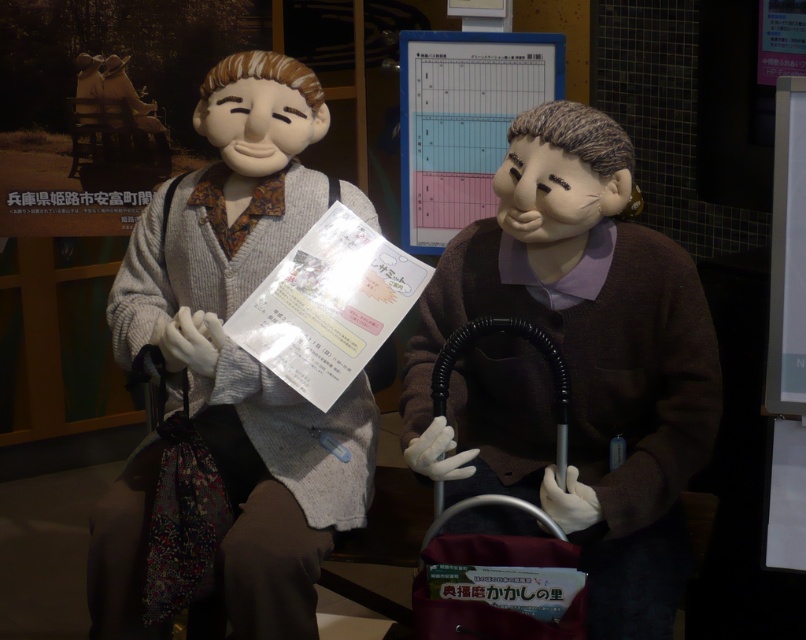
Based on the photo, between matte gray sweater at left and black rubber baby carriage at lower center, which one has less height?

black rubber baby carriage at lower center is shorter.

From the picture: Can you confirm if matte gray sweater at left is positioned to the right of black rubber baby carriage at lower center?

No, matte gray sweater at left is not to the right of black rubber baby carriage at lower center.

Find the location of a particular element. matte gray sweater at left is located at coordinates (243, 349).

Is the position of matte gray sweater at center less distant than that of black rubber baby carriage at lower center?

That is False.

Is matte gray sweater at center taller than black rubber baby carriage at lower center?

Correct, matte gray sweater at center is much taller as black rubber baby carriage at lower center.

You are a GUI agent. You are given a task and a screenshot of the screen. Output one action in this format:
    pyautogui.click(x=<x>, y=<y>)
    Task: Click on the matte gray sweater at center
    The width and height of the screenshot is (806, 640).
    Given the screenshot: What is the action you would take?
    pyautogui.click(x=582, y=364)

Can you confirm if brown matte sweater at center is wider than matte gray sweater at left?

No.

Locate an element on the screen. brown matte sweater at center is located at coordinates (575, 364).

Is point (646, 372) positioned before point (251, 76)?

Yes, it is in front of point (251, 76).

Identify the location of brown matte sweater at center. (575, 364).